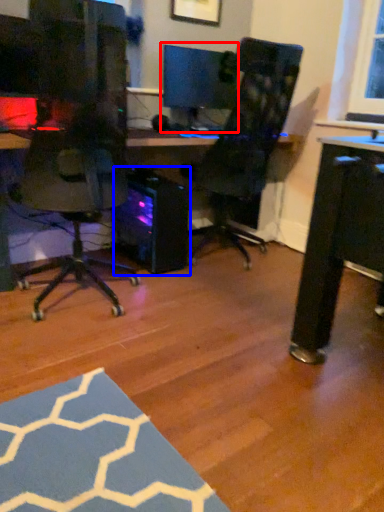
Question: Which point is closer to the camera, computer monitor (highlighted by a red box) or computer tower (highlighted by a blue box)?

Choices:
 (A) computer monitor
 (B) computer tower

Answer: (B)